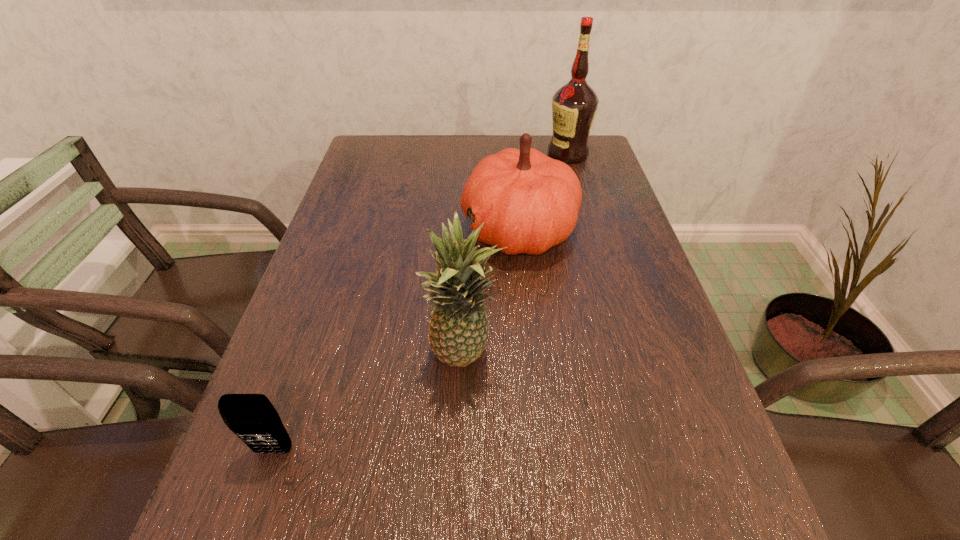
What are the coordinates of `vacant region that satisfies the following two spatial constraints: 1. on the label of the tallest object; 2. on the screen of the cellular telephone` in the screenshot? It's located at (653, 451).